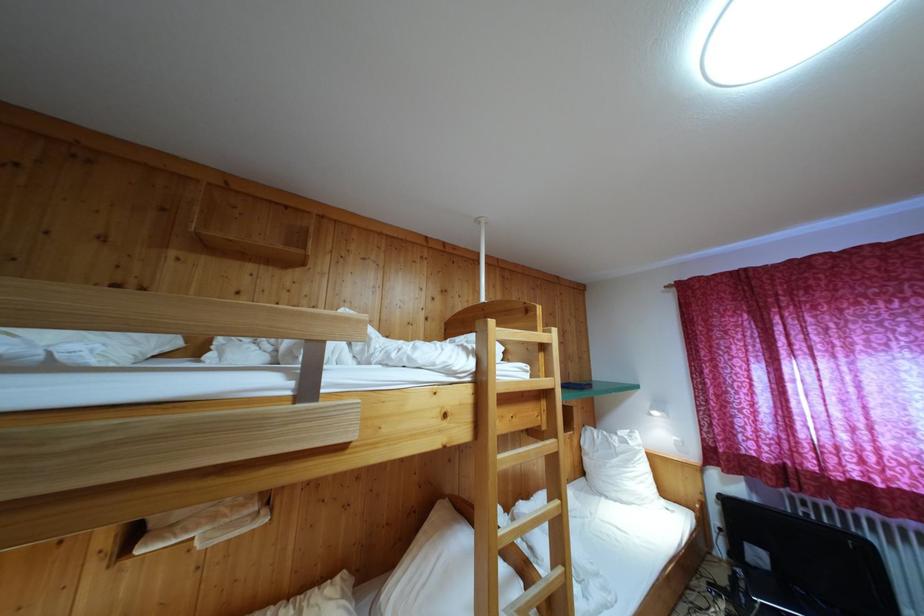
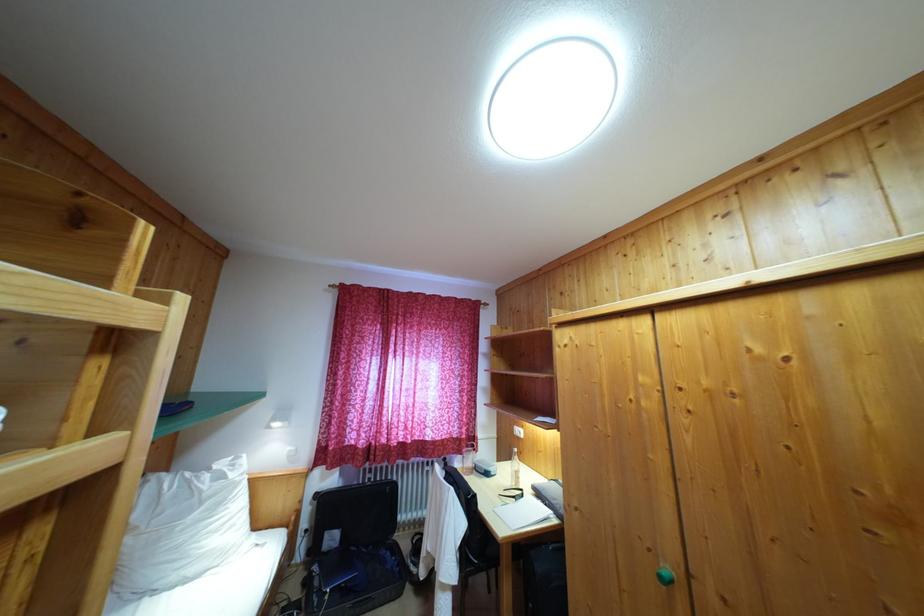
Question: The images are taken continuously from a first-person perspective. In which direction is your viewpoint rotating?

Choices:
 (A) Left
 (B) Right
 (C) Up
 (D) Down

Answer: (B)